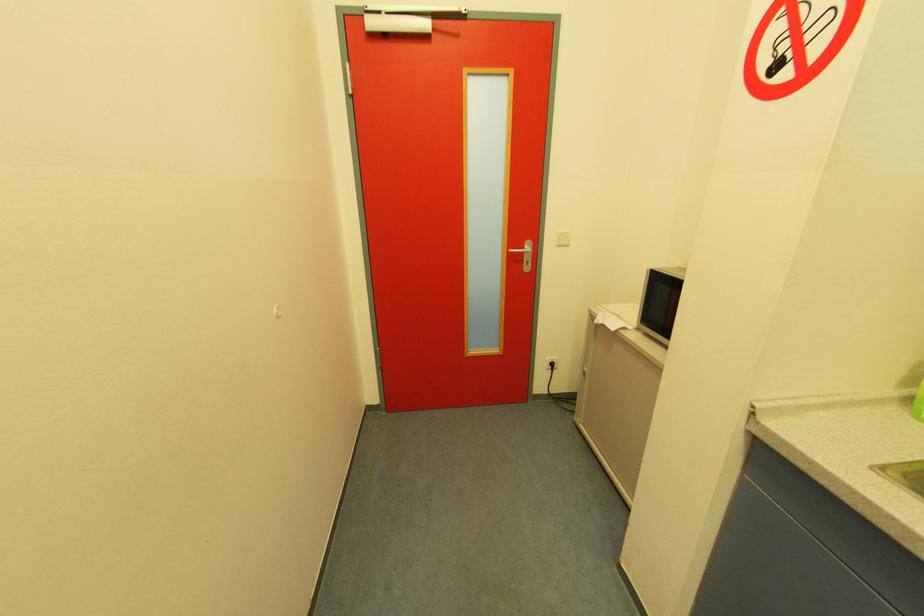
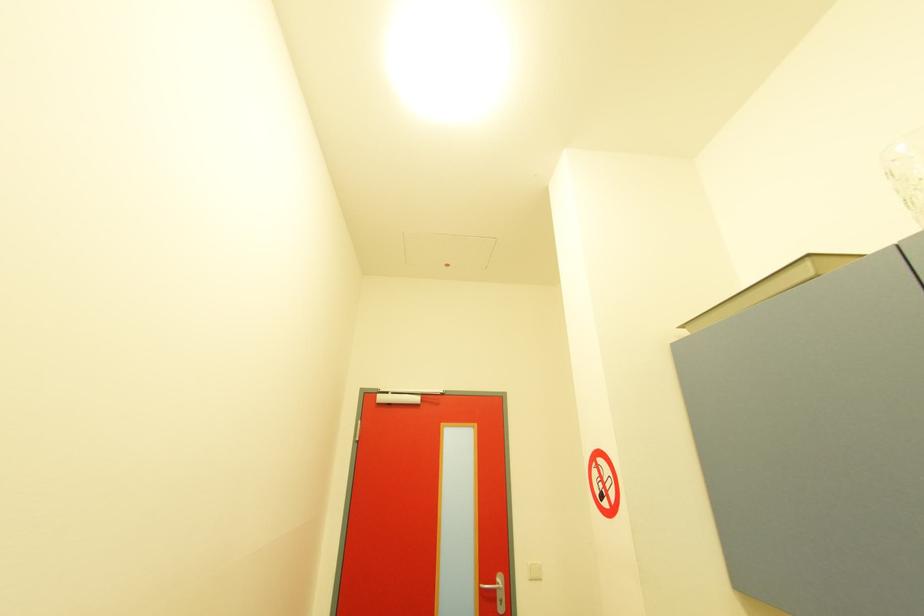
Question: The images are taken continuously from a first-person perspective. In which direction is your viewpoint rotating?

Choices:
 (A) Left
 (B) Right
 (C) Up
 (D) Down

Answer: (C)